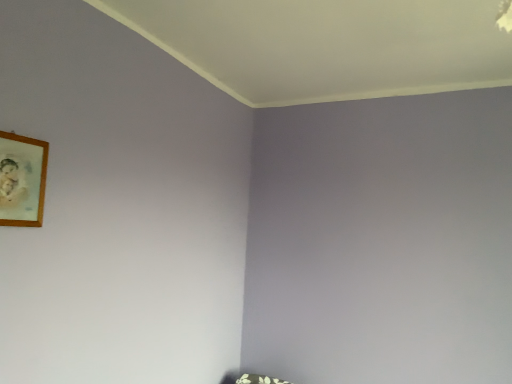
At what (x,y) coordinates should I click in order to perform the action: click on wooden picture frame at upper left. Please return your answer as a coordinate pair (x, y). The height and width of the screenshot is (384, 512). Looking at the image, I should click on (22, 179).

The image size is (512, 384). What do you see at coordinates (22, 179) in the screenshot? I see `wooden picture frame at upper left` at bounding box center [22, 179].

The width and height of the screenshot is (512, 384). Identify the location of wooden picture frame at upper left. (22, 179).